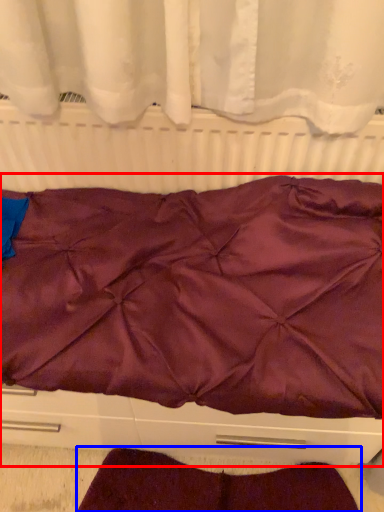
Question: Which object appears closest to the camera in this image, furniture (highlighted by a red box) or blanket (highlighted by a blue box)?

Choices:
 (A) furniture
 (B) blanket

Answer: (A)